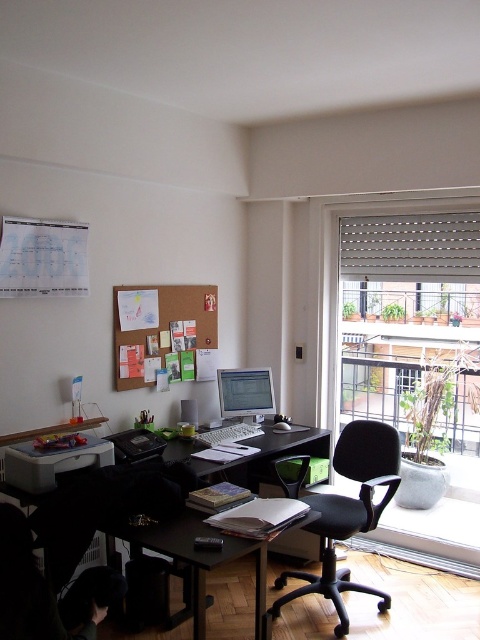
Question: Which of the following is the farthest from the observer?

Choices:
 (A) black plastic table at center
 (B) corkboard at upper center
 (C) black plastic swivel chair at center

Answer: (B)

Question: Can you confirm if roller blinds at right is thinner than white fabric blind at upper right?

Choices:
 (A) no
 (B) yes

Answer: (A)

Question: Among these objects, which one is nearest to the camera?

Choices:
 (A) roller blinds at right
 (B) corkboard at upper center
 (C) matte white printer at lower left

Answer: (C)

Question: Where is roller blinds at right located in relation to black plastic swivel chair at center in the image?

Choices:
 (A) right
 (B) left

Answer: (A)

Question: Can you confirm if black plastic swivel chair at center is positioned to the left of matte white printer at lower left?

Choices:
 (A) no
 (B) yes

Answer: (A)

Question: Which point is closer to the camera?

Choices:
 (A) roller blinds at right
 (B) matte silver desktop computer at center
 (C) corkboard at upper center
 (D) black plastic table at center

Answer: (D)